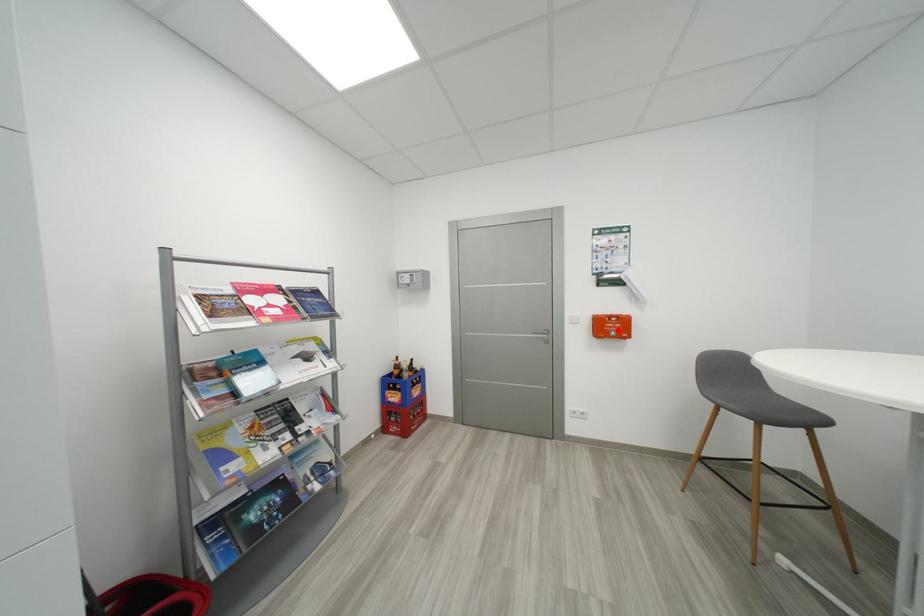
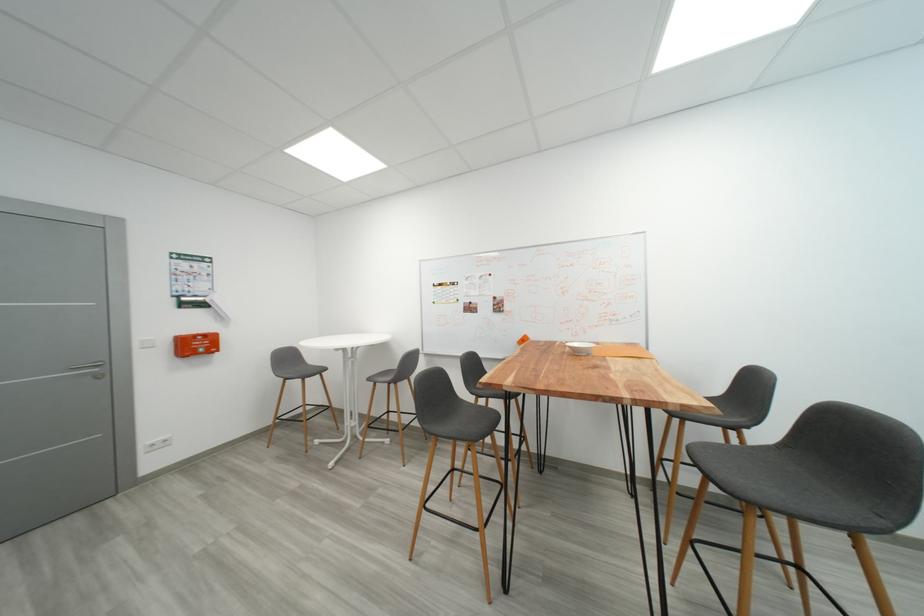
Where in the second image is the point corresponding to the highlighted location from the first image?

(203, 347)